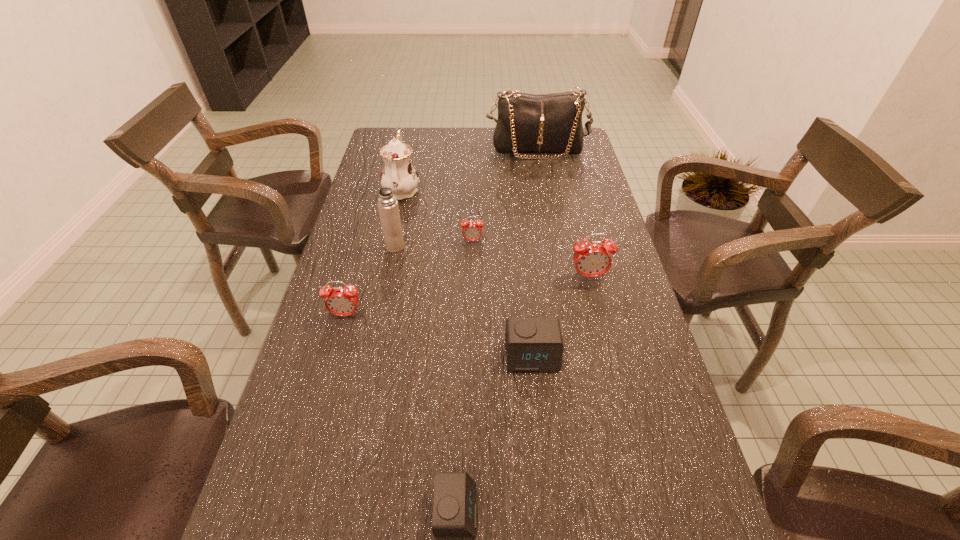
Locate an element on the screen. This screenshot has width=960, height=540. free spot at the left edge of the desktop is located at coordinates (379, 183).

In the image, there is a desktop. Where is `free space at the right edge`? free space at the right edge is located at coordinates pyautogui.click(x=593, y=199).

In the image, there is a desktop. At what (x,y) coordinates should I click in order to perform the action: click on vacant area at the far right corner. Please return your answer as a coordinate pair (x, y). This screenshot has width=960, height=540. Looking at the image, I should click on (581, 158).

Locate an element on the screen. free space between the shortest alarm clock and the farthest object is located at coordinates (496, 330).

Image resolution: width=960 pixels, height=540 pixels. In order to click on free space that is in between the second farthest alarm clock and the left black alarm clock in this screenshot , I will do `click(522, 394)`.

Where is `vacant point located between the fifth shortest object and the farthest object`? The height and width of the screenshot is (540, 960). vacant point located between the fifth shortest object and the farthest object is located at coordinates (563, 214).

This screenshot has height=540, width=960. I want to click on free spot between the farther black alarm clock and the seventh nearest object, so click(x=467, y=272).

Where is `vacant space that's between the thermos bottle and the seventh farthest object`? The height and width of the screenshot is (540, 960). vacant space that's between the thermos bottle and the seventh farthest object is located at coordinates (464, 301).

I want to click on vacant area between the farthest object and the shortest object, so click(x=496, y=330).

Find the location of `free space between the fourth nearest alarm clock and the seventh farthest object`. free space between the fourth nearest alarm clock and the seventh farthest object is located at coordinates (561, 316).